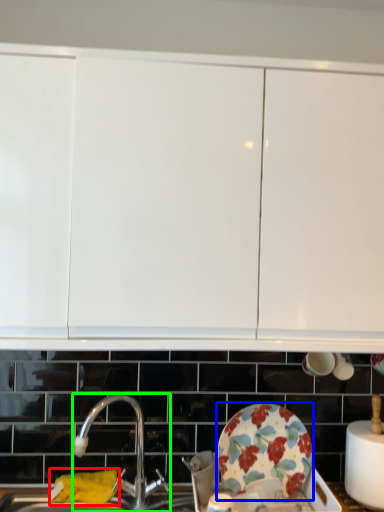
Question: Which is nearer to the material (highlighted by a red box)? plate (highlighted by a blue box) or tap (highlighted by a green box).

Choices:
 (A) plate
 (B) tap

Answer: (B)